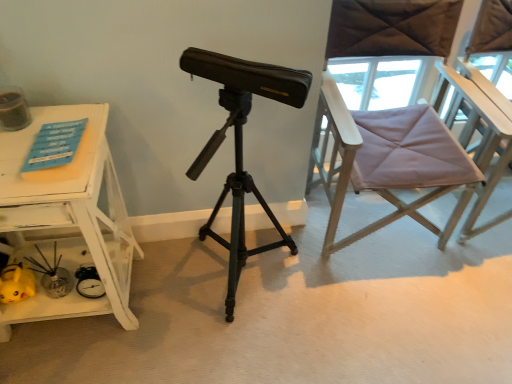
Identify the location of free space that is to the left of matte black tripod at center. (170, 290).